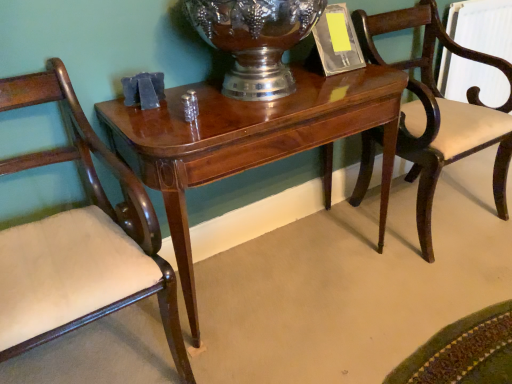
Question: Does shiny silver vase at center have a greater height compared to shiny wood table at center?

Choices:
 (A) no
 (B) yes

Answer: (A)

Question: Can you confirm if shiny silver vase at center is thinner than shiny wood table at center?

Choices:
 (A) no
 (B) yes

Answer: (B)

Question: Considering the relative sizes of shiny silver vase at center and shiny wood table at center in the image provided, is shiny silver vase at center wider than shiny wood table at center?

Choices:
 (A) yes
 (B) no

Answer: (B)

Question: Is shiny silver vase at center further to camera compared to shiny wood table at center?

Choices:
 (A) yes
 (B) no

Answer: (A)

Question: Considering the relative positions of shiny silver vase at center and shiny wood table at center in the image provided, is shiny silver vase at center to the left of shiny wood table at center from the viewer's perspective?

Choices:
 (A) yes
 (B) no

Answer: (A)

Question: From a real-world perspective, is mahogany wood chair at right, the first chair when ordered from right to left, physically located above or below shiny silver vase at center?

Choices:
 (A) below
 (B) above

Answer: (A)

Question: Visually, is mahogany wood chair at right, the first chair when ordered from right to left, positioned to the left or to the right of shiny silver vase at center?

Choices:
 (A) left
 (B) right

Answer: (B)

Question: Based on their sizes in the image, would you say mahogany wood chair at right, the first chair when ordered from right to left, is bigger or smaller than shiny silver vase at center?

Choices:
 (A) small
 (B) big

Answer: (B)

Question: From the image's perspective, is mahogany wood chair at right, the first chair when ordered from right to left, located above or below shiny silver vase at center?

Choices:
 (A) below
 (B) above

Answer: (A)

Question: In the image, is mahogany wood chair at right, placed as the 2th chair when sorted from left to right, positioned in front of or behind shiny wood table at center?

Choices:
 (A) front
 (B) behind

Answer: (B)

Question: From a real-world perspective, is mahogany wood chair at right, placed as the 2th chair when sorted from left to right, positioned above or below shiny wood table at center?

Choices:
 (A) above
 (B) below

Answer: (A)

Question: Based on their sizes in the image, would you say mahogany wood chair at right, placed as the 2th chair when sorted from left to right, is bigger or smaller than shiny wood table at center?

Choices:
 (A) small
 (B) big

Answer: (A)

Question: Is point (420, 81) closer or farther from the camera than point (181, 185)?

Choices:
 (A) closer
 (B) farther

Answer: (B)

Question: Considering the positions of shiny silver vase at center and shiny wood table at center in the image, is shiny silver vase at center wider or thinner than shiny wood table at center?

Choices:
 (A) wide
 (B) thin

Answer: (B)

Question: Relative to shiny wood table at center, is shiny silver vase at center in front or behind?

Choices:
 (A) front
 (B) behind

Answer: (B)